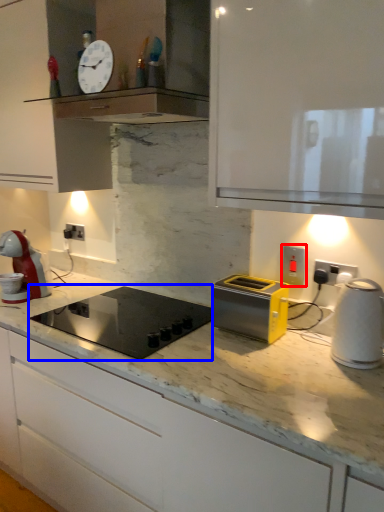
Question: Which object appears farthest to the camera in this image, electric outlet (highlighted by a red box) or home appliance (highlighted by a blue box)?

Choices:
 (A) electric outlet
 (B) home appliance

Answer: (A)